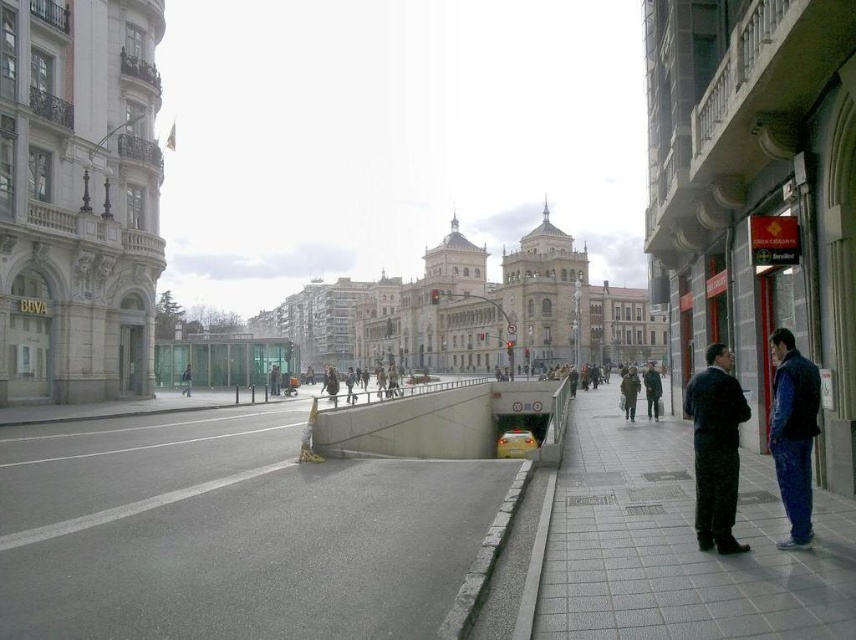
Measure the distance between dark blue fabric coat at right and green fabric coat at lower right.

The distance of dark blue fabric coat at right from green fabric coat at lower right is 101.27 feet.

Can you confirm if dark blue fabric coat at right is bigger than green fabric coat at lower right?

No.

This screenshot has width=856, height=640. Describe the element at coordinates (715, 449) in the screenshot. I see `dark blue fabric coat at right` at that location.

At what (x,y) coordinates should I click in order to perform the action: click on dark blue fabric coat at right. Please return your answer as a coordinate pair (x, y). This screenshot has width=856, height=640. Looking at the image, I should click on (715, 449).

Does gray tile pavement at lower right appear over dark blue fabric coat at right?

Incorrect, gray tile pavement at lower right is not positioned above dark blue fabric coat at right.

Which is behind, point (685, 525) or point (703, 474)?

Point (685, 525)

This screenshot has width=856, height=640. I want to click on gray tile pavement at lower right, so click(679, 545).

Does gray tile pavement at lower right lie in front of green fabric coat at lower right?

Yes.

Does gray tile pavement at lower right have a smaller size compared to green fabric coat at lower right?

Yes, gray tile pavement at lower right is smaller than green fabric coat at lower right.

Is point (684, 426) positioned in front of point (627, 404)?

Yes, it is.

In order to click on gray tile pavement at lower right in this screenshot , I will do `click(679, 545)`.